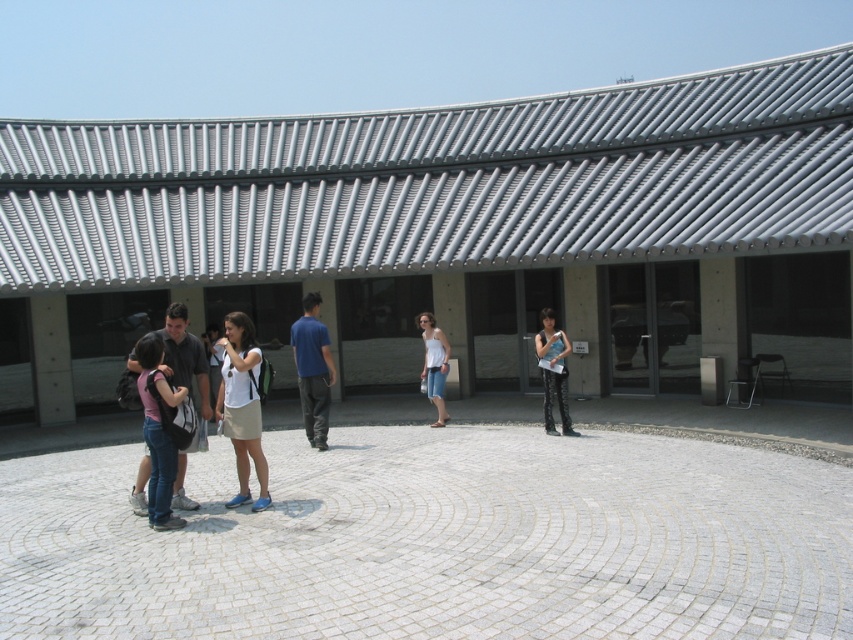
You are standing in the outdoor scene and want to know which object is taller between the white stone courtyard at center and the white cotton tank top at center. Which one is taller?

The white cotton tank top at center is taller than the white stone courtyard at center.

You are standing at the entrance of the building and want to reach the white stone courtyard at center. According to the coordinates provided, in which direction should you move relative to your current position?

The white stone courtyard at center is located at coordinates point (437, 540), so you should move forward from the entrance to reach it.

You are standing in front of the modern building with the curved roof. You see two people wearing white tops in the center of the image. Which one is the white matte shirt at center closer to you compared to the white cotton tank top at center?

The white matte shirt at center is closer to the viewer than the white cotton tank top at center.